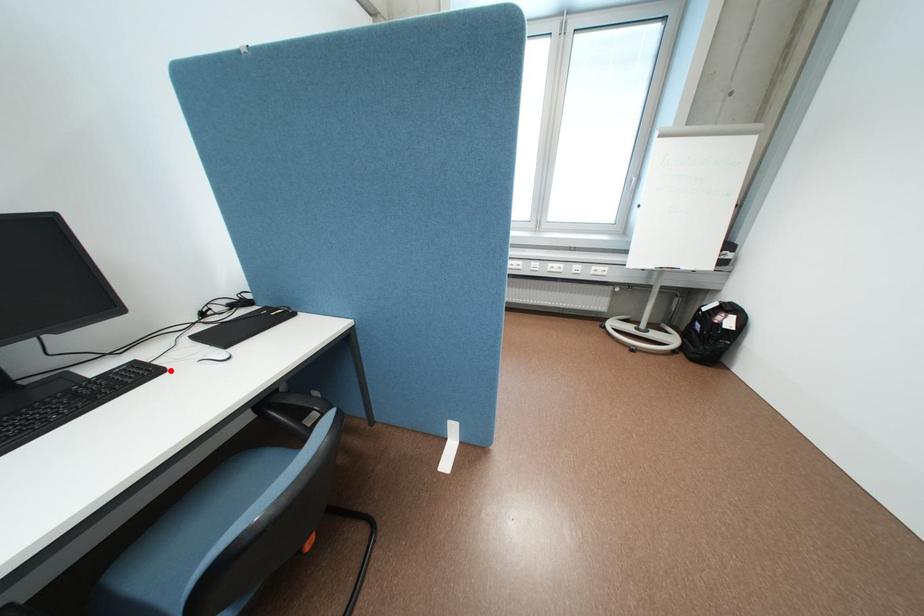
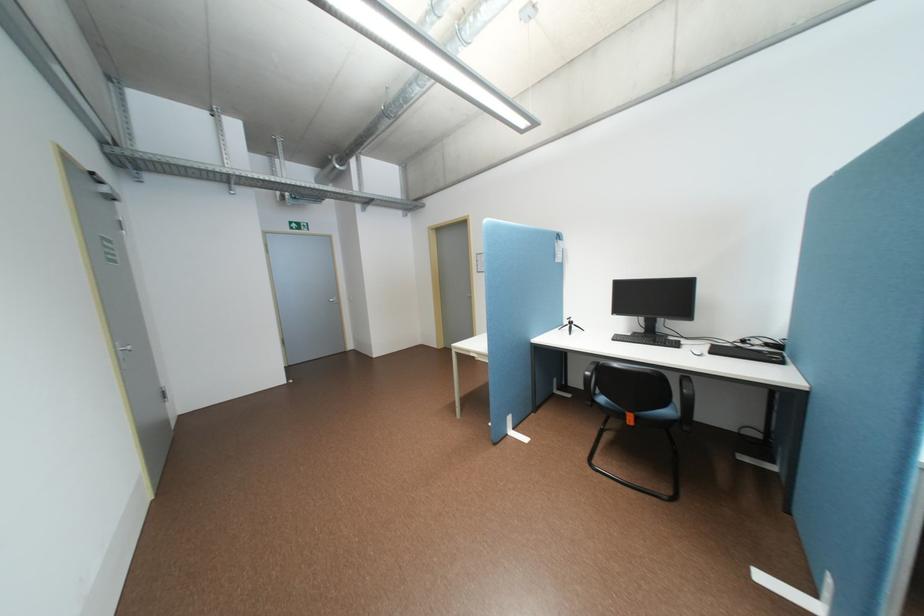
Find the pixel in the second image that matches the highlighted location in the first image.

(688, 346)